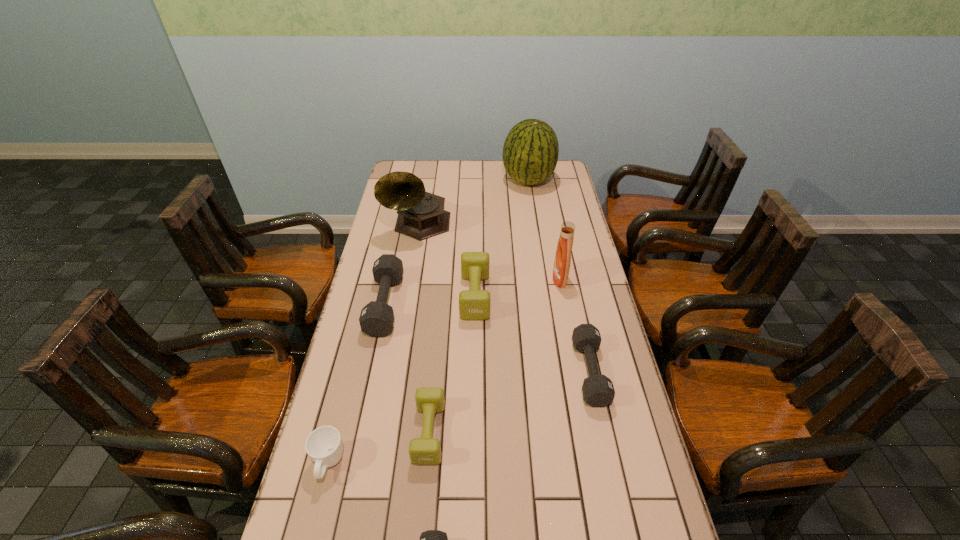
The height and width of the screenshot is (540, 960). I want to click on blank area located with the handle on the side of the cup, so point(318,510).

I want to click on vacant space positioned 0.110m on the back of the rightmost gray dumbbell, so click(x=577, y=314).

Find the location of `vacant space located on the left of the left olive dumbbell`. vacant space located on the left of the left olive dumbbell is located at coordinates (373, 433).

Find the location of a particular element. Image resolution: width=960 pixels, height=540 pixels. object that is at the far edge is located at coordinates (530, 153).

Locate an element on the screen. phonograph record that is at the left edge is located at coordinates (421, 215).

At what (x,y) coordinates should I click in order to perform the action: click on dumbbell located at the left edge. Please return your answer as a coordinate pair (x, y). Looking at the image, I should click on (376, 319).

You are a GUI agent. You are given a task and a screenshot of the screen. Output one action in this format:
    pyautogui.click(x=<x>, y=<y>)
    Task: Click on the cup positioned at the left edge
    Image resolution: width=960 pixels, height=540 pixels.
    Given the screenshot: What is the action you would take?
    pyautogui.click(x=324, y=445)

At what (x,y) coordinates should I click in order to perform the action: click on watermelon positioned at the right edge. Please return your answer as a coordinate pair (x, y). The height and width of the screenshot is (540, 960). Looking at the image, I should click on (530, 153).

The height and width of the screenshot is (540, 960). Identify the location of detergent present at the right edge. (562, 262).

This screenshot has height=540, width=960. I want to click on dumbbell situated at the right edge, so click(x=598, y=391).